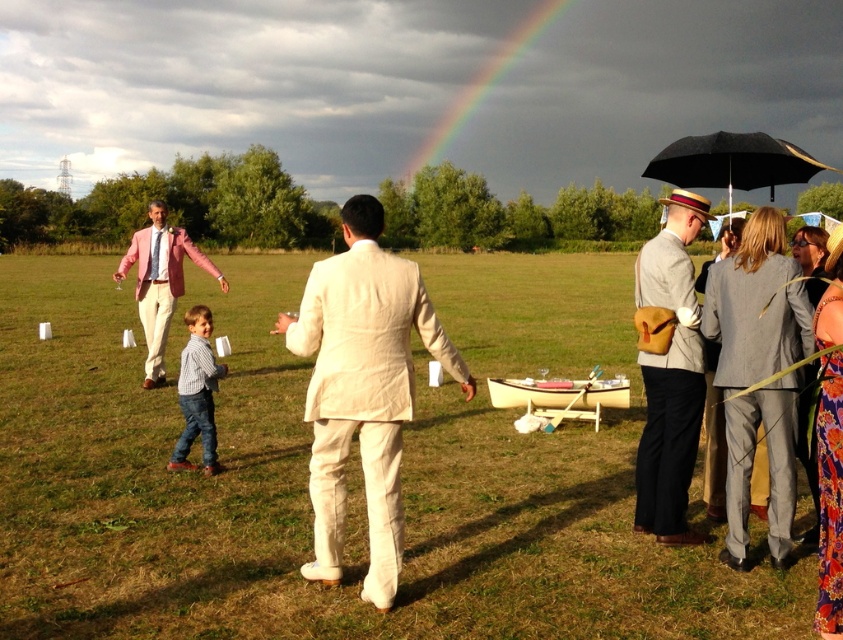
You are standing at the camera position and see two points in the scene. Which point is closer to you, point (377, 464) or point (683, 408)?

Point (377, 464) is in front of point (683, 408), so it is closer to you.

You are standing at the point marked as point (x=160, y=282) in the image. What object is located at this specific coordinate?

The pink linen suit at left is located at point (x=160, y=282).